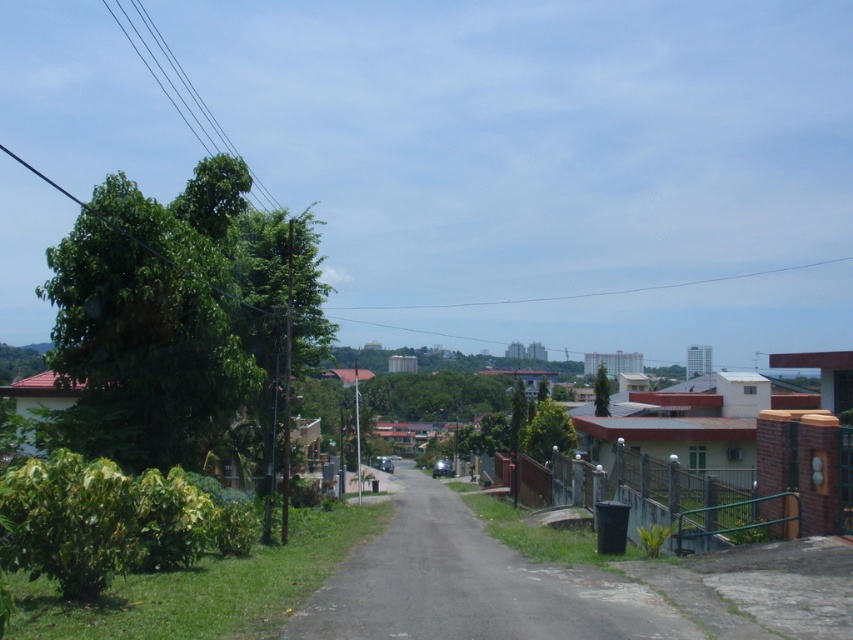
You are a bird looking for a place to perch. You see the green leafy tree at left and the gray asphalt road at center. Which location is taller and better for a high vantage point?

The green leafy tree at left is much taller than the gray asphalt road at center, so it provides a better high vantage point for perching.

In the scene shown: You are a pedestrian walking along the gray asphalt road at center. You notice a green leafy tree at left. In which direction relative to the road is the tree located?

The green leafy tree at left is located above the gray asphalt road at center, meaning it is positioned higher up in the scene compared to the road.

You are a pedestrian standing on the sidewalk and want to cross the gray asphalt road at center. Before crossing, you notice the green leafy tree at left. Which object is closer to you according to the scene?

The green leafy tree at left is closer to you than the gray asphalt road at center because the road is positioned behind the tree.